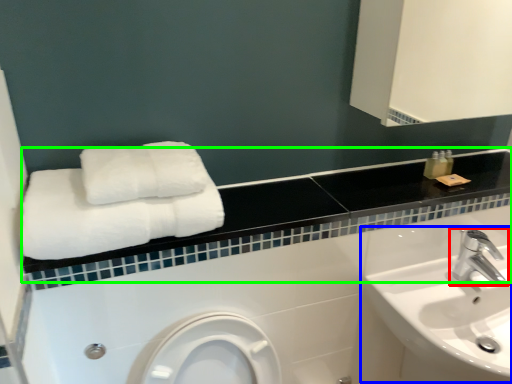
Question: Based on their relative distances, which object is nearer to tap (highlighted by a red box)? Choose from sink (highlighted by a blue box) and balustrade (highlighted by a green box).

Choices:
 (A) sink
 (B) balustrade

Answer: (A)